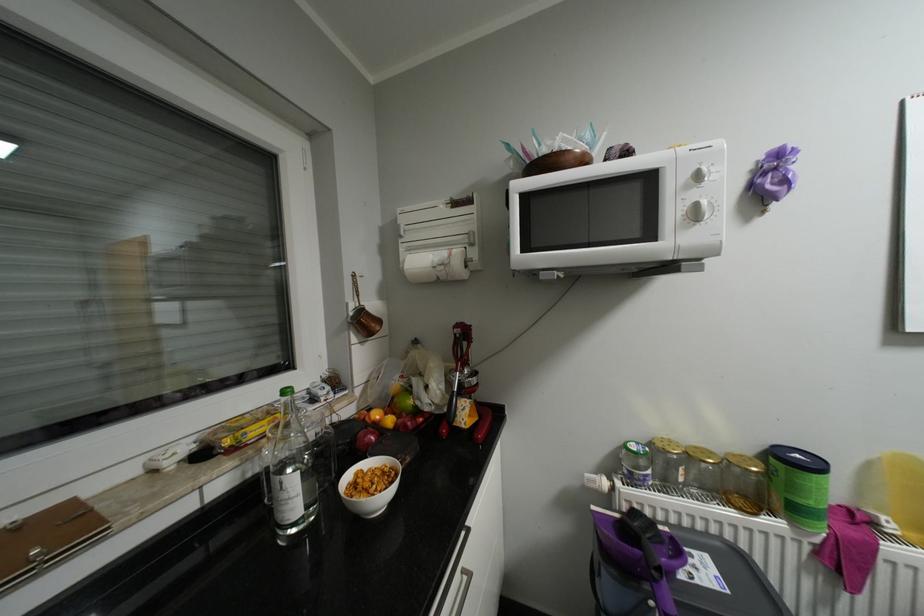
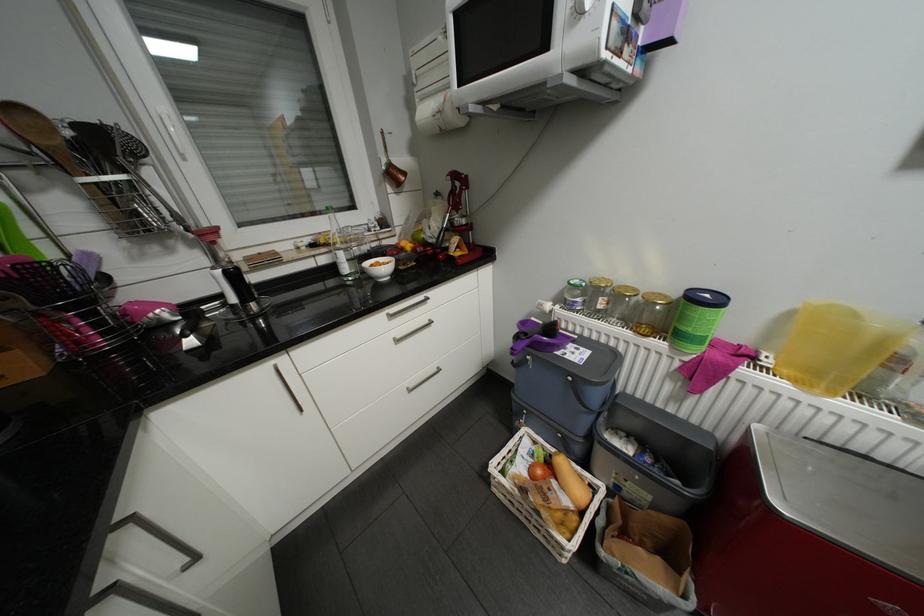
The images are taken continuously from a first-person perspective. In which direction is your viewpoint rotating?

The camera's rotation is toward left-down.